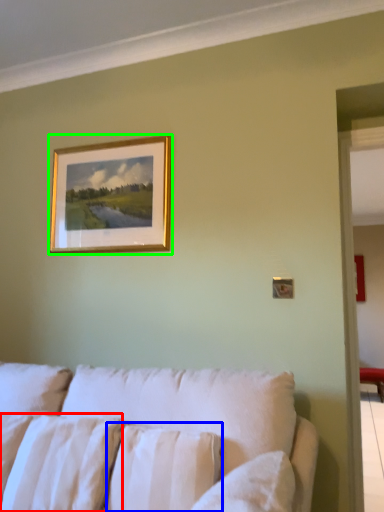
Question: Estimate the real-world distances between objects in this image. Which object is farther from pillow (highlighted by a red box), pillow (highlighted by a blue box) or picture frame (highlighted by a green box)?

Choices:
 (A) pillow
 (B) picture frame

Answer: (B)